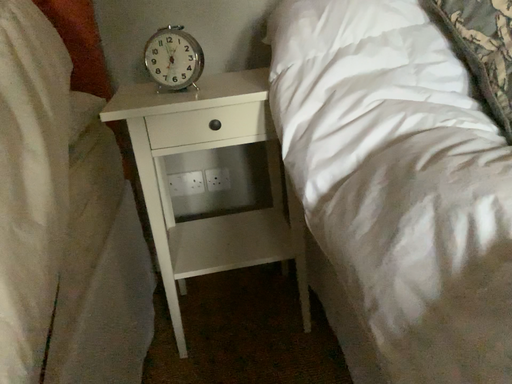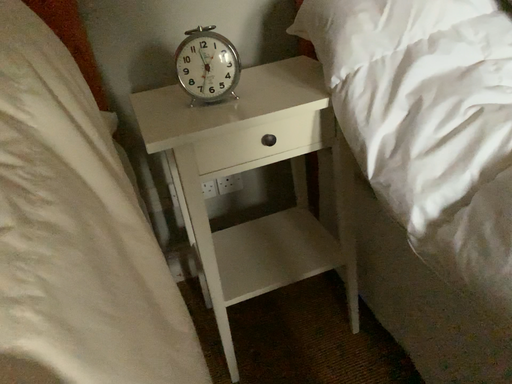
Question: Which way did the camera rotate in the video?

Choices:
 (A) rotated left
 (B) rotated right

Answer: (B)